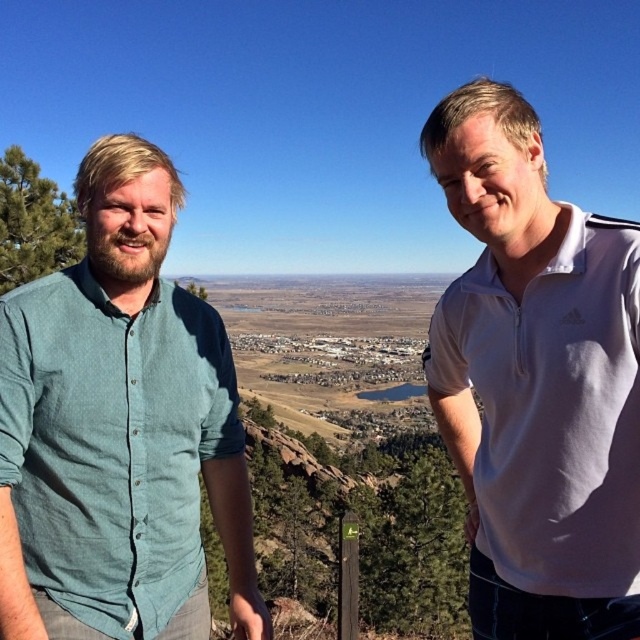
Which is more to the left, teal cotton shirt at left or white cotton polo shirt at right?

teal cotton shirt at left

Is teal cotton shirt at left below white cotton polo shirt at right?

No, teal cotton shirt at left is not below white cotton polo shirt at right.

The image size is (640, 640). What do you see at coordinates (120, 429) in the screenshot? I see `teal cotton shirt at left` at bounding box center [120, 429].

Find the location of a particular element. Image resolution: width=640 pixels, height=640 pixels. teal cotton shirt at left is located at coordinates (120, 429).